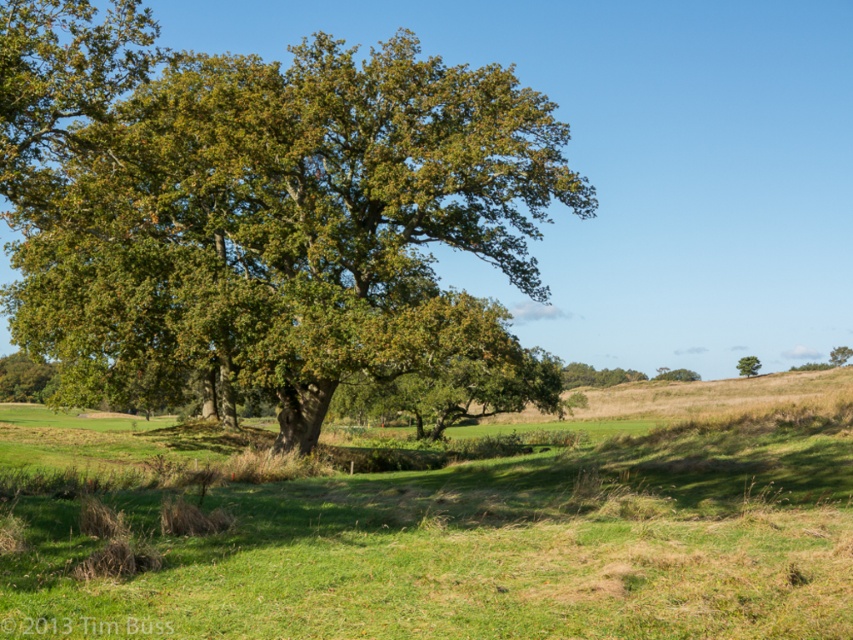
Where is `green matte tree at right`? This screenshot has width=853, height=640. green matte tree at right is located at coordinates (747, 365).

Does point (753, 362) come closer to viewer compared to point (834, 346)?

Yes, point (753, 362) is in front of point (834, 346).

This screenshot has width=853, height=640. Describe the element at coordinates (747, 365) in the screenshot. I see `green matte tree at right` at that location.

The height and width of the screenshot is (640, 853). I want to click on green matte tree at right, so 747,365.

Looking at this image, is green leafy oak tree at upper left positioned in front of green leafy tree at upper center?

Yes, green leafy oak tree at upper left is closer to the viewer.

Locate an element on the screen. The width and height of the screenshot is (853, 640). green leafy oak tree at upper left is located at coordinates (277, 221).

This screenshot has width=853, height=640. I want to click on green leafy oak tree at upper left, so click(x=277, y=221).

From the picture: Which is more to the left, green leafy oak tree at upper left or green matte tree at right?

From the viewer's perspective, green leafy oak tree at upper left appears more on the left side.

Identify the location of green leafy oak tree at upper left. (277, 221).